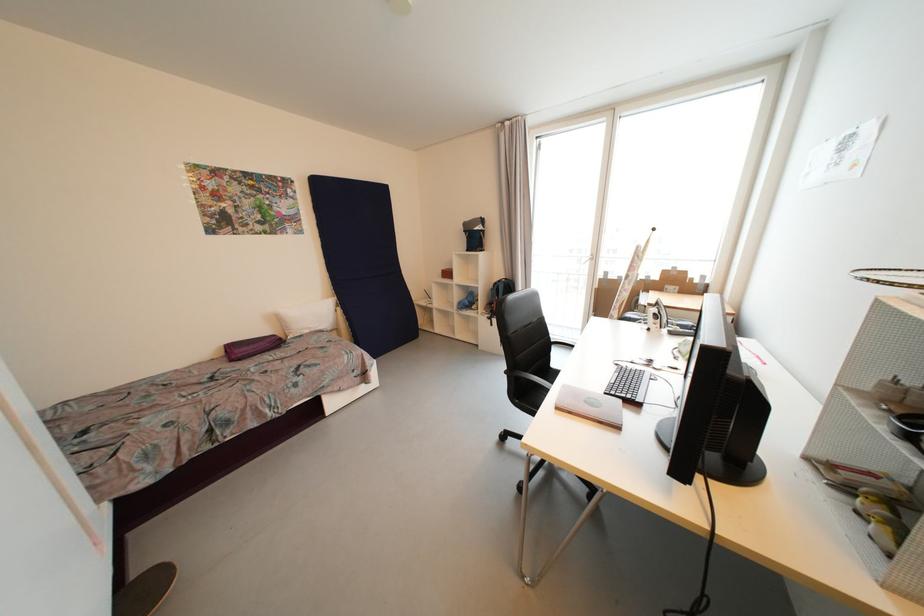
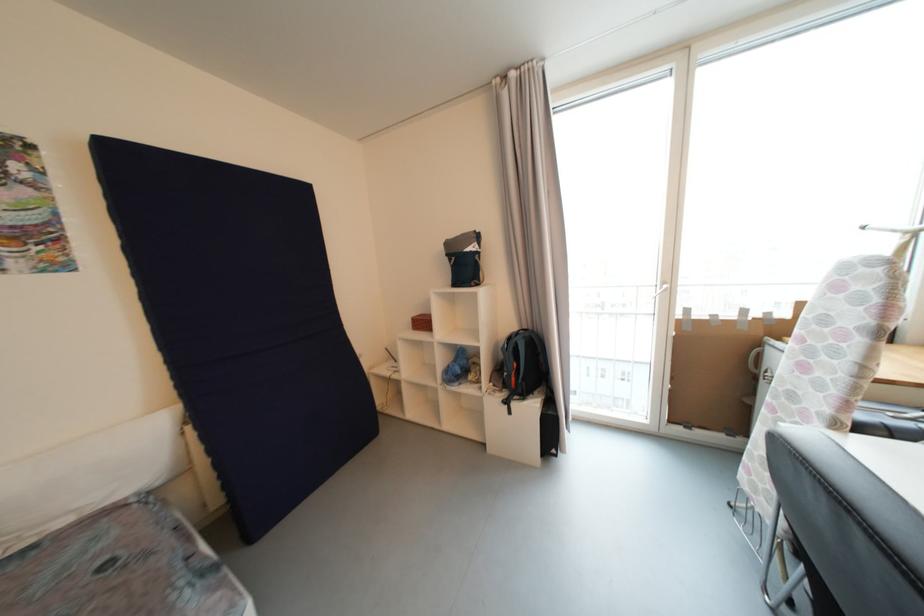
Question: The images are taken continuously from a first-person perspective. In which direction are you moving?

Choices:
 (A) Left
 (B) Right
 (C) Forward
 (D) Backward

Answer: (C)